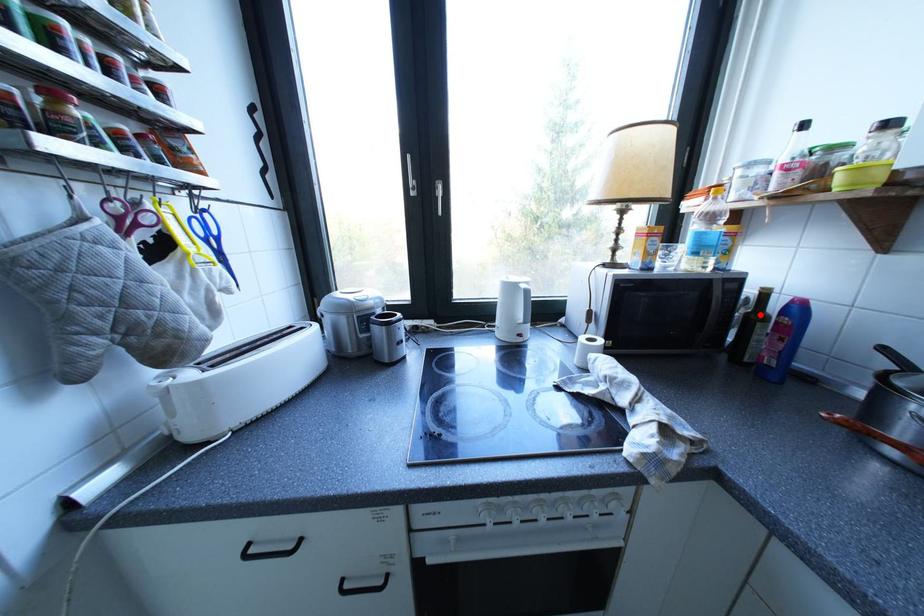
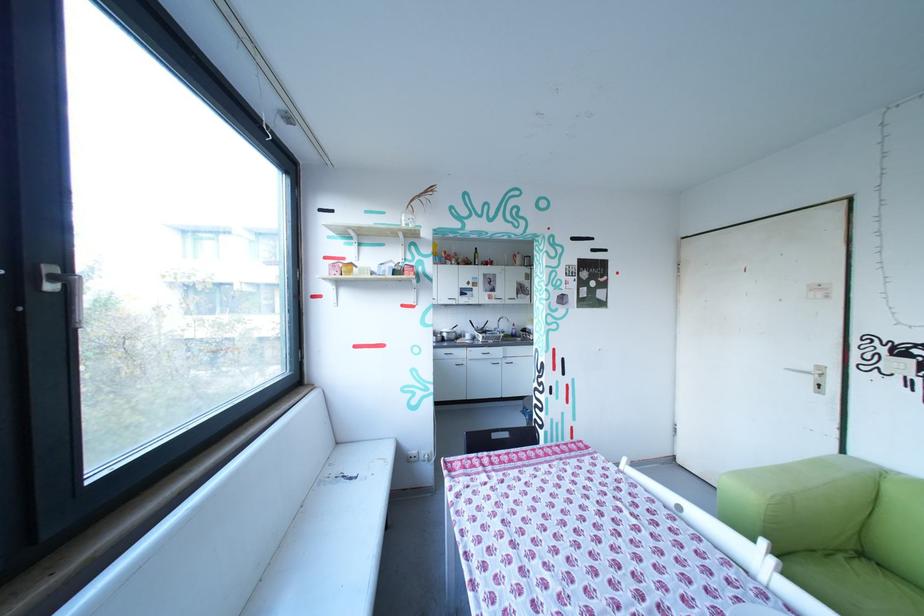
Question: I am providing you with two images of the same scene from different viewpoints. A red point is marked on the first image. Can you still see the location of the red point in image 2?

Choices:
 (A) Yes
 (B) No

Answer: (B)